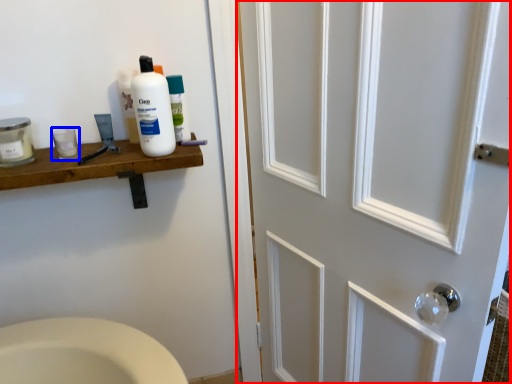
Question: Which point is further to the camera, door (highlighted by a red box) or mouthwash (highlighted by a blue box)?

Choices:
 (A) door
 (B) mouthwash

Answer: (B)